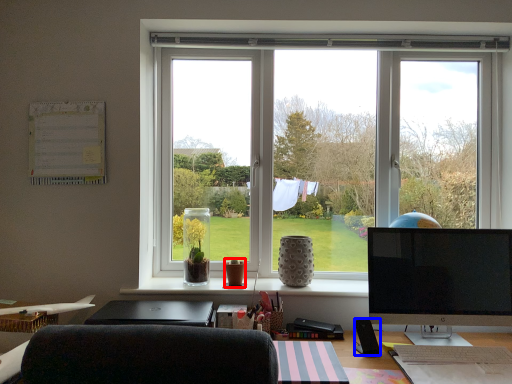
Question: Which point is further to the camera, vase (highlighted by a red box) or loudspeaker (highlighted by a blue box)?

Choices:
 (A) vase
 (B) loudspeaker

Answer: (A)